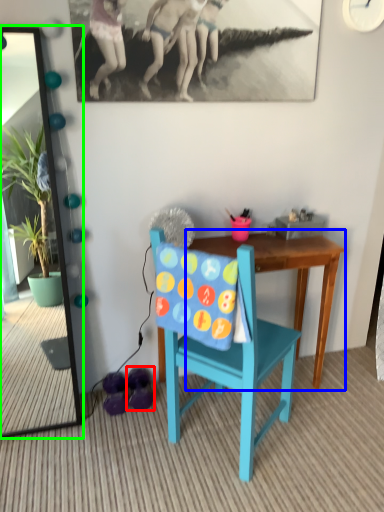
Question: Which object is the closest to the footwear (highlighted by a red box)? Choose among these: table (highlighted by a blue box) or mirror (highlighted by a green box).

Choices:
 (A) table
 (B) mirror

Answer: (A)